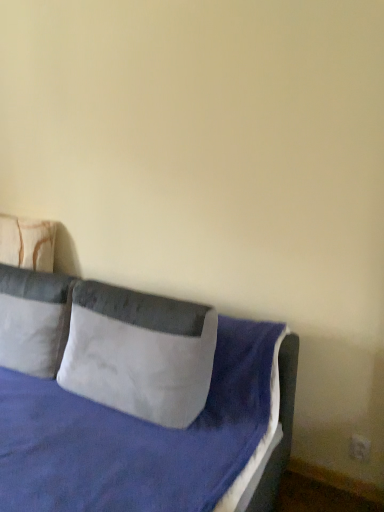
Question: Should I look upward or downward to see white soft pillow at left, positioned as the second pillow in left-to-right order?

Choices:
 (A) down
 (B) up

Answer: (A)

Question: From the image's perspective, would you say white soft pillow at left, arranged as the 2th pillow when viewed from the right, is positioned over velvet blue bed at center?

Choices:
 (A) no
 (B) yes

Answer: (B)

Question: Does white soft pillow at left, arranged as the 2th pillow when viewed from the right, have a greater height compared to velvet blue bed at center?

Choices:
 (A) no
 (B) yes

Answer: (A)

Question: From a real-world perspective, is white soft pillow at left, positioned as the second pillow in left-to-right order, located higher than velvet blue bed at center?

Choices:
 (A) yes
 (B) no

Answer: (A)

Question: Can you confirm if white soft pillow at left, positioned as the second pillow in left-to-right order, is thinner than velvet blue bed at center?

Choices:
 (A) yes
 (B) no

Answer: (A)

Question: Considering the relative sizes of white soft pillow at left, arranged as the 2th pillow when viewed from the right, and velvet blue bed at center in the image provided, is white soft pillow at left, arranged as the 2th pillow when viewed from the right, smaller than velvet blue bed at center?

Choices:
 (A) no
 (B) yes

Answer: (B)

Question: Is white soft pillow at left, arranged as the 2th pillow when viewed from the right, facing towards velvet blue bed at center?

Choices:
 (A) yes
 (B) no

Answer: (A)

Question: Is gray suede pillow at center, acting as the 3th pillow starting from the left, positioned with its back to beige fabric pillow at left, which appears as the third pillow when viewed from the right?

Choices:
 (A) yes
 (B) no

Answer: (B)

Question: From a real-world perspective, is gray suede pillow at center, which ranks as the first pillow in right-to-left order, positioned over beige fabric pillow at left, which appears as the third pillow when viewed from the right, based on gravity?

Choices:
 (A) no
 (B) yes

Answer: (A)

Question: Is gray suede pillow at center, acting as the 3th pillow starting from the left, further to camera compared to beige fabric pillow at left, marked as the first pillow in a left-to-right arrangement?

Choices:
 (A) yes
 (B) no

Answer: (B)

Question: Is gray suede pillow at center, acting as the 3th pillow starting from the left, outside of beige fabric pillow at left, marked as the first pillow in a left-to-right arrangement?

Choices:
 (A) no
 (B) yes

Answer: (B)

Question: Would you say gray suede pillow at center, acting as the 3th pillow starting from the left, contains beige fabric pillow at left, marked as the first pillow in a left-to-right arrangement?

Choices:
 (A) yes
 (B) no

Answer: (B)

Question: Does gray suede pillow at center, which ranks as the first pillow in right-to-left order, have a greater width compared to beige fabric pillow at left, which appears as the third pillow when viewed from the right?

Choices:
 (A) yes
 (B) no

Answer: (A)

Question: Does white soft pillow at left, arranged as the 2th pillow when viewed from the right, have a greater height compared to gray suede pillow at center, which ranks as the first pillow in right-to-left order?

Choices:
 (A) no
 (B) yes

Answer: (B)